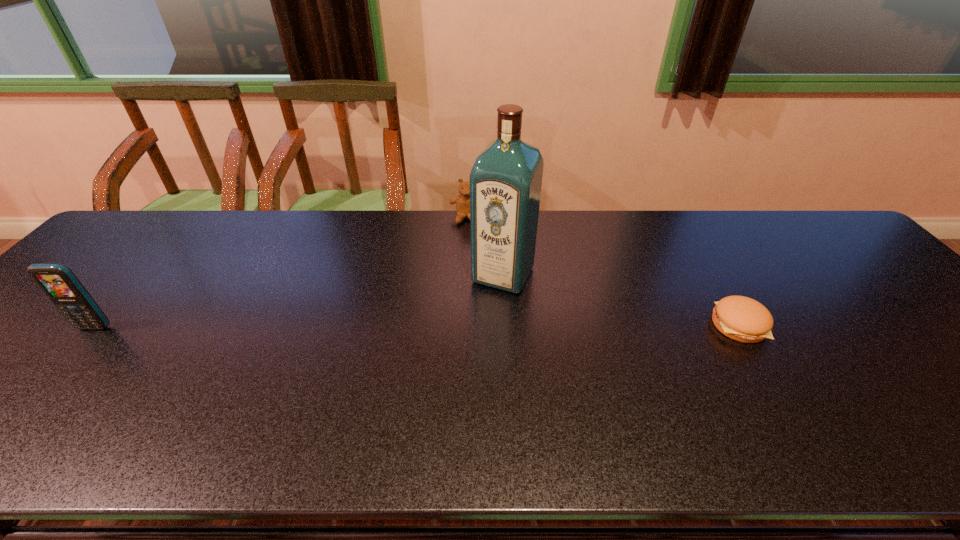
The image size is (960, 540). In order to click on free space located 0.320m on the flat label side of the tallest object in this screenshot , I will do `click(440, 392)`.

I want to click on vacant space located 0.290m on the flat label side of the tallest object, so click(445, 380).

In order to click on free spot located 0.360m on the flat label side of the tallest object in this screenshot , I will do `click(431, 407)`.

In order to click on free spot located 0.160m on the face of the third tallest object in this screenshot , I will do `click(465, 257)`.

Locate an element on the screen. free spot located on the face of the third tallest object is located at coordinates (465, 266).

The width and height of the screenshot is (960, 540). In order to click on blank space located 0.190m on the face of the third tallest object in this screenshot , I will do `click(465, 264)`.

Locate an element on the screen. liquor that is at the far edge is located at coordinates click(505, 181).

Identify the location of teddy bear that is at the far edge. (462, 201).

You are a GUI agent. You are given a task and a screenshot of the screen. Output one action in this format:
    pyautogui.click(x=<x>, y=<y>)
    Task: Click on the object at the left edge
    This screenshot has width=960, height=540.
    Given the screenshot: What is the action you would take?
    58,282

The image size is (960, 540). In order to click on free location at the far edge in this screenshot , I will do `click(614, 220)`.